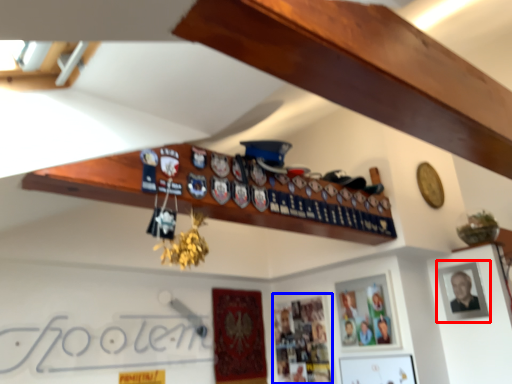
Question: Which object is closer to the camera taking this photo, picture frame (highlighted by a red box) or picture frame (highlighted by a blue box)?

Choices:
 (A) picture frame
 (B) picture frame

Answer: (A)